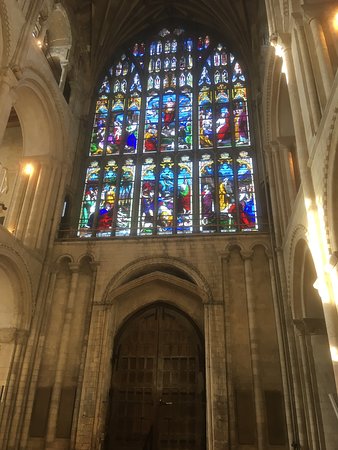
You are a GUI agent. You are given a task and a screenshot of the screen. Output one action in this format:
    pyautogui.click(x=<x>, y=<y>)
    Task: Click on the light
    The image size is (338, 450).
    Given the screenshot: What is the action you would take?
    pyautogui.click(x=28, y=166)